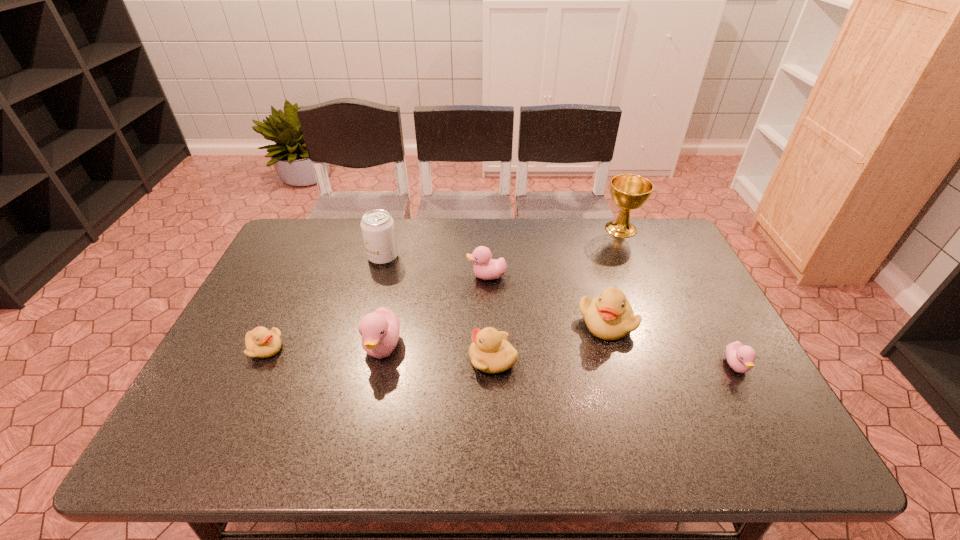
Identify the location of vacant space located on the front-facing side of the farthest pink duckling. (414, 276).

What are the coordinates of `free space located 0.340m on the beak of the second yellow duckling from left to right` in the screenshot? It's located at (331, 359).

Identify the location of vacant space located on the beak of the second yellow duckling from left to right. The width and height of the screenshot is (960, 540). [384, 359].

Where is `free region located 0.200m on the beak of the second yellow duckling from left to right`? free region located 0.200m on the beak of the second yellow duckling from left to right is located at coordinates 388,359.

Locate an element on the screen. This screenshot has width=960, height=540. vacant space located 0.400m on the beak of the leftmost duckling is located at coordinates (442, 349).

Locate an element on the screen. Image resolution: width=960 pixels, height=540 pixels. chalice located at the far edge is located at coordinates (629, 192).

Identify the location of soda can present at the far edge. The width and height of the screenshot is (960, 540). (377, 226).

Image resolution: width=960 pixels, height=540 pixels. I want to click on object at the left edge, so click(260, 342).

The height and width of the screenshot is (540, 960). In order to click on chalice that is at the right edge in this screenshot , I will do `click(629, 192)`.

Find the location of a particular element. Image resolution: width=960 pixels, height=540 pixels. duckling that is at the right edge is located at coordinates (740, 357).